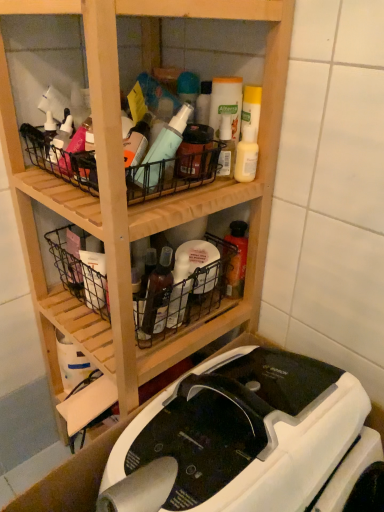
Question: Does black wire basket at center, which is the second basket in top-to-bottom order, appear on the right side of white plastic sewing machine at lower center?

Choices:
 (A) no
 (B) yes

Answer: (A)

Question: Considering the relative sizes of black wire basket at center, which is the second basket in top-to-bottom order, and white plastic sewing machine at lower center in the image provided, is black wire basket at center, which is the second basket in top-to-bottom order, smaller than white plastic sewing machine at lower center?

Choices:
 (A) no
 (B) yes

Answer: (B)

Question: From the image's perspective, is black wire basket at center, which is the second basket in top-to-bottom order, beneath white plastic sewing machine at lower center?

Choices:
 (A) yes
 (B) no

Answer: (B)

Question: Considering the relative sizes of black wire basket at center, the 1th basket positioned from the bottom, and white plastic sewing machine at lower center in the image provided, is black wire basket at center, the 1th basket positioned from the bottom, shorter than white plastic sewing machine at lower center?

Choices:
 (A) no
 (B) yes

Answer: (B)

Question: Does black wire basket at center, the 1th basket positioned from the bottom, have a greater height compared to white plastic sewing machine at lower center?

Choices:
 (A) yes
 (B) no

Answer: (B)

Question: Would you say white plastic sewing machine at lower center is part of black wire basket at center, which is the second basket in top-to-bottom order,'s contents?

Choices:
 (A) no
 (B) yes

Answer: (A)

Question: Is wooden shelf at center further to camera compared to black wire basket at center, which is the second basket in top-to-bottom order?

Choices:
 (A) yes
 (B) no

Answer: (B)

Question: Considering the relative sizes of wooden shelf at center and black wire basket at center, the 1th basket positioned from the bottom, in the image provided, is wooden shelf at center wider than black wire basket at center, the 1th basket positioned from the bottom,?

Choices:
 (A) no
 (B) yes

Answer: (B)

Question: Is wooden shelf at center positioned with its back to black wire basket at center, the 1th basket positioned from the bottom?

Choices:
 (A) no
 (B) yes

Answer: (B)

Question: Can you confirm if wooden shelf at center is bigger than black wire basket at center, which is the second basket in top-to-bottom order?

Choices:
 (A) yes
 (B) no

Answer: (A)

Question: Are wooden shelf at center and black wire basket at center, which is the second basket in top-to-bottom order, far apart?

Choices:
 (A) yes
 (B) no

Answer: (B)

Question: From a real-world perspective, is wooden shelf at center beneath black wire basket at center, which is the second basket in top-to-bottom order?

Choices:
 (A) yes
 (B) no

Answer: (A)

Question: Does black wire basket at upper center, the second basket from the bottom, have a lesser height compared to wooden shelf at center?

Choices:
 (A) no
 (B) yes

Answer: (B)